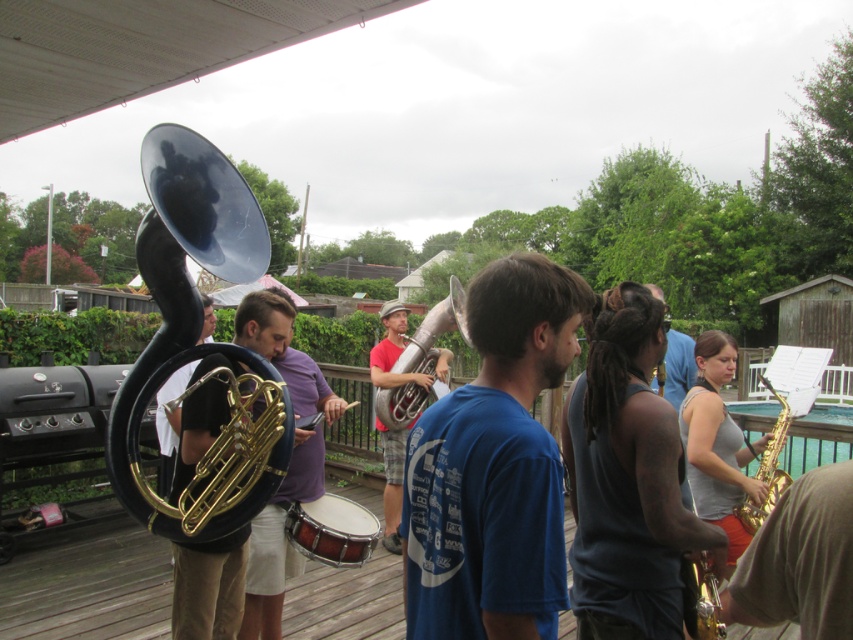
You are a photographer trying to capture a clear shot of the gray tank top at center and the red matte tuba at center. Since you want to focus on the person, which object should you adjust your camera to focus on first considering their height?

The gray tank top at center has a lesser height compared to the red matte tuba at center, so you should focus on the gray tank top at center first as it is closer to the camera.

You are a photographer setting up for a group photo. You need to position the wooden snare drum at center and the blue shirt at center so that both are clearly visible in the frame. Based on their sizes, which object should be placed closer to the camera to ensure both fit well in the photo?

The wooden snare drum at center has a lesser width compared to the blue shirt at center. To ensure both fit well in the photo, the snare drum should be placed closer to the camera since it is smaller and requires less space, allowing the larger blue shirt to be positioned further back but still visible.